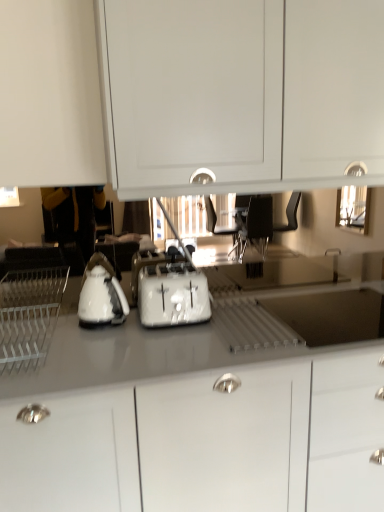
Question: Considering their positions, is white matte cabinet at upper center, which is the first cabinetry from top to bottom, located in front of or behind white glossy cabinet at center, acting as the 2th cabinetry starting from the top?

Choices:
 (A) behind
 (B) front

Answer: (A)

Question: Considering the positions of white matte cabinet at upper center, which appears as the 2th cabinetry when ordered from the bottom, and white glossy cabinet at center, acting as the 2th cabinetry starting from the top, in the image, is white matte cabinet at upper center, which appears as the 2th cabinetry when ordered from the bottom, bigger or smaller than white glossy cabinet at center, acting as the 2th cabinetry starting from the top,?

Choices:
 (A) big
 (B) small

Answer: (B)

Question: Which is nearer to the white glossy electric kettle at center?

Choices:
 (A) white plastic dish rack at left
 (B) white matte cabinet at upper center, which appears as the 2th cabinetry when ordered from the bottom
 (C) white plastic toaster at center
 (D) white glossy cabinet at center, acting as the 2th cabinetry starting from the top

Answer: (C)

Question: Estimate the real-world distances between objects in this image. Which object is farther from the white glossy cabinet at center, acting as the 2th cabinetry starting from the top?

Choices:
 (A) white matte cabinet at upper center, which is the first cabinetry from top to bottom
 (B) white plastic dish rack at left
 (C) white plastic toaster at center
 (D) white glossy electric kettle at center

Answer: (A)